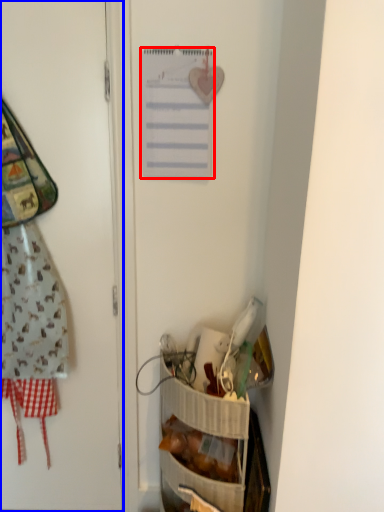
Question: Which object is further to the camera taking this photo, list (highlighted by a red box) or door (highlighted by a blue box)?

Choices:
 (A) list
 (B) door

Answer: (A)